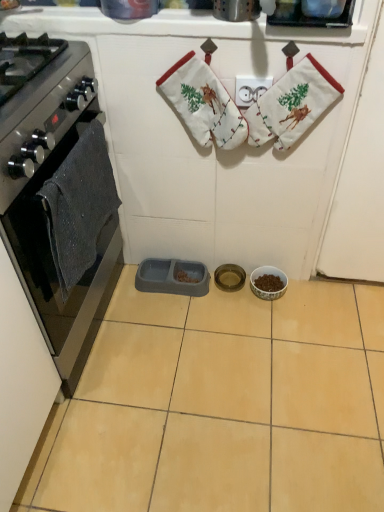
You are a GUI agent. You are given a task and a screenshot of the screen. Output one action in this format:
    pyautogui.click(x=<x>, y=<y>)
    Task: Click on the free space above beige ceramic tile at center (from a real-world perspective)
    This screenshot has width=384, height=512.
    Given the screenshot: What is the action you would take?
    pyautogui.click(x=235, y=376)